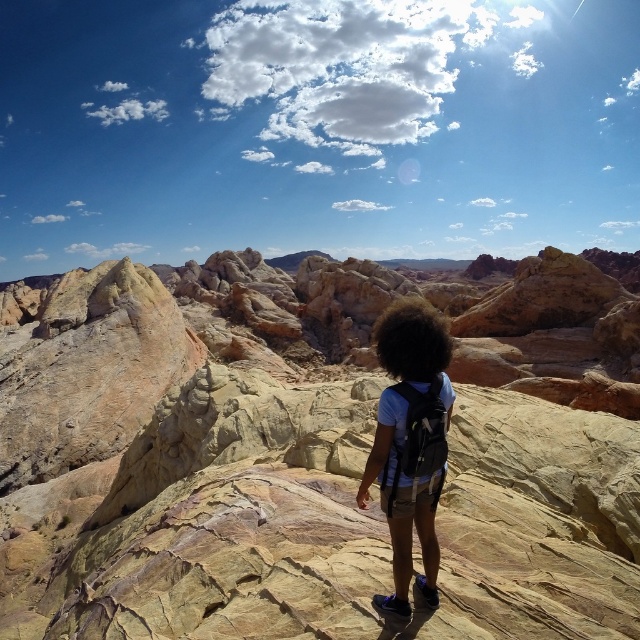
You are a geologist examining the scene. You notice the smooth sandstone rock at center and the dark curly hair at center. Which object is taller?

The smooth sandstone rock at center is taller than the dark curly hair at center.